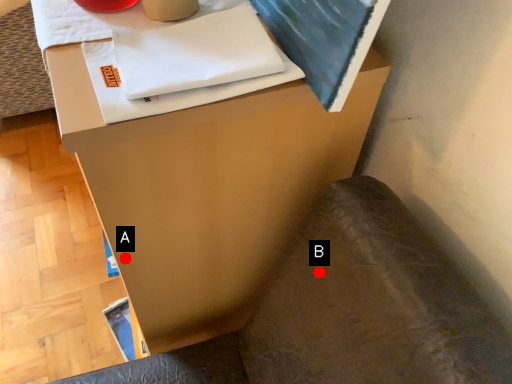
Question: Two points are circled on the image, labeled by A and B beside each circle. Which point is closer to the camera?

Choices:
 (A) A is closer
 (B) B is closer

Answer: (B)